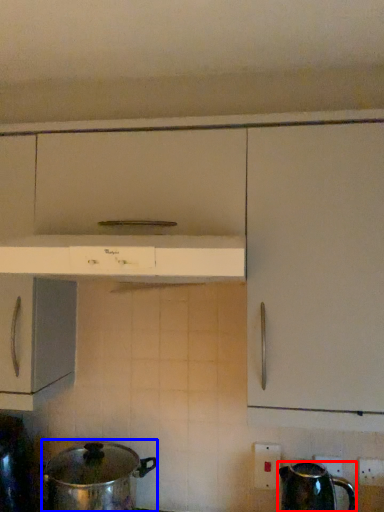
Question: Which point is closer to the camera, kettle (highlighted by a red box) or crock pot (highlighted by a blue box)?

Choices:
 (A) kettle
 (B) crock pot

Answer: (A)